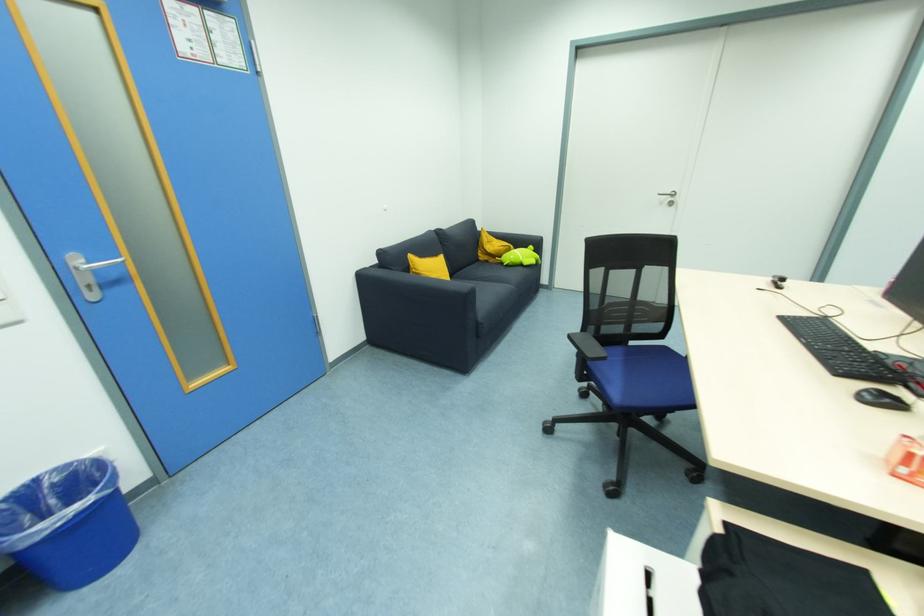
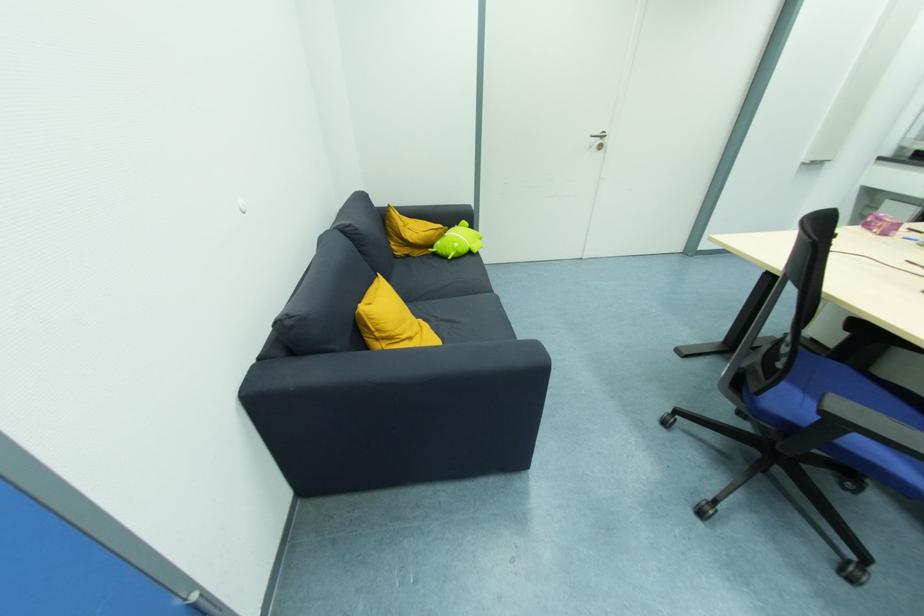
Where in the second image is the point corresponding to the point at 504,257 from the first image?

(435, 248)